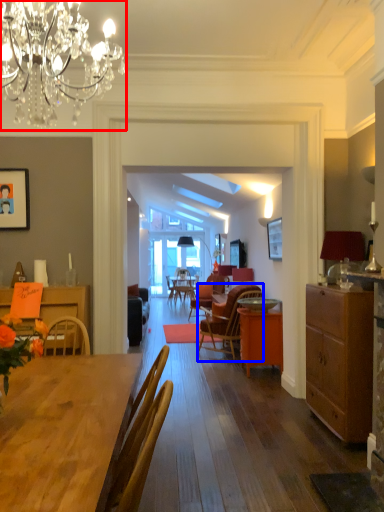
Question: Which object is closer to the camera taking this photo, lamp (highlighted by a red box) or chair (highlighted by a blue box)?

Choices:
 (A) lamp
 (B) chair

Answer: (A)